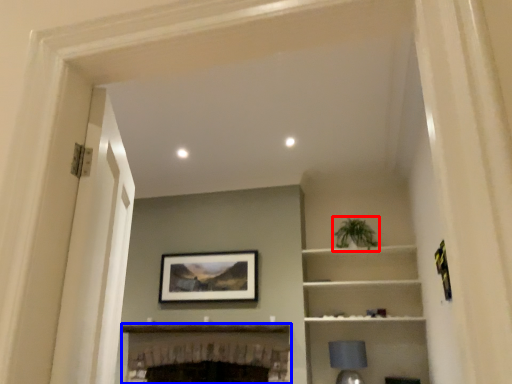
Question: Which of the following is the farthest to the observer, plant (highlighted by a red box) or fireplace (highlighted by a blue box)?

Choices:
 (A) plant
 (B) fireplace

Answer: (A)